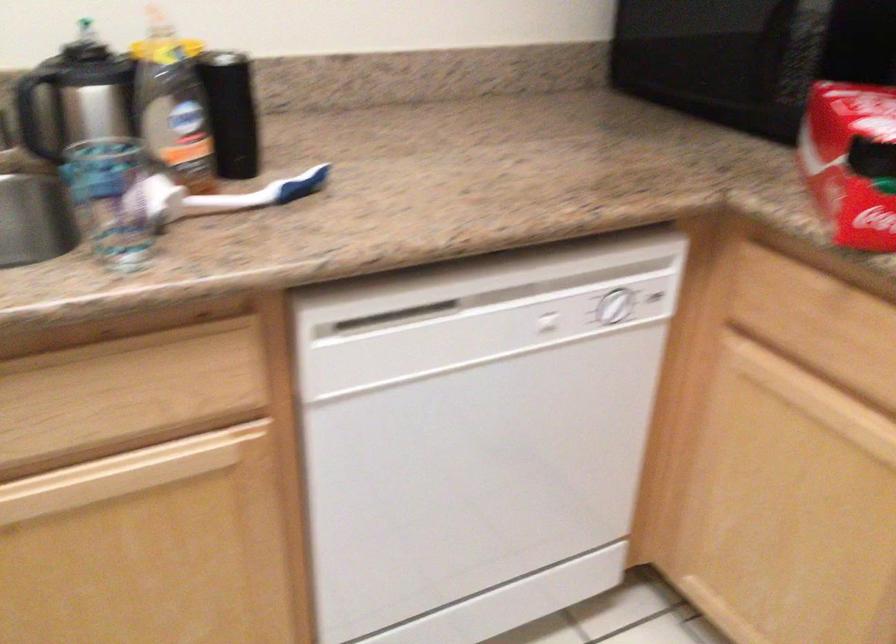
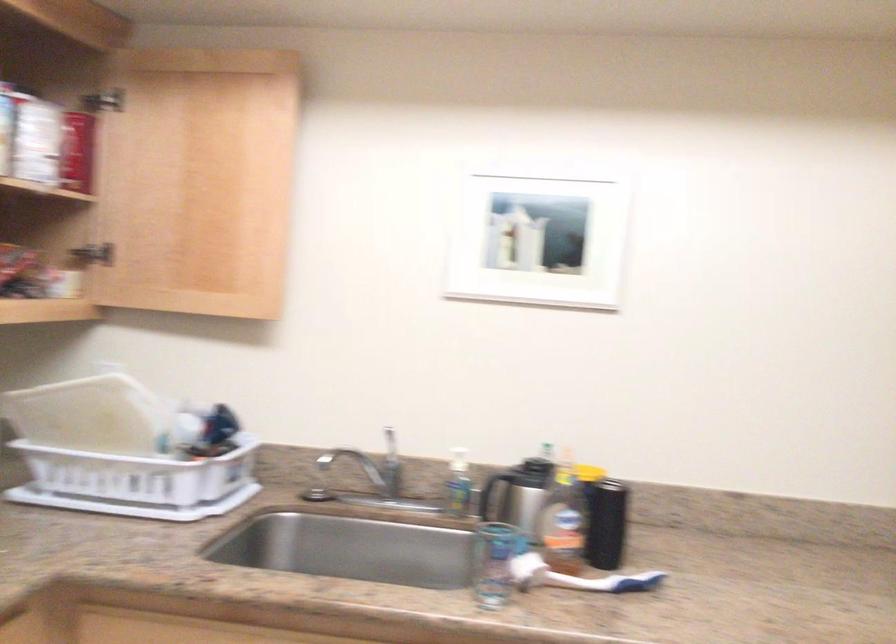
First-person continuous shooting, in which direction is the camera rotating?

The camera rotated toward left-up.